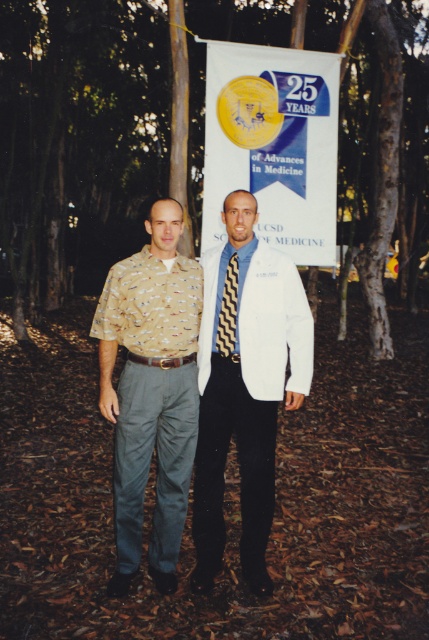
You are a photographer standing in front of two people. You want to take a photo of the white cotton dress shirt at center and the black zigzag tie at center. Which one is on the right side?

The white cotton dress shirt at center is positioned on the right side of black zigzag tie at center.

You are a photographer trying to capture a clear shot of both the camouflage shirt at left and the black zigzag tie at center. Since you want to focus on the tie first, which object should you adjust your camera to focus on first?

The camouflage shirt at left is below the black zigzag tie at center, so you should focus on the black zigzag tie at center first as it is higher in the frame.